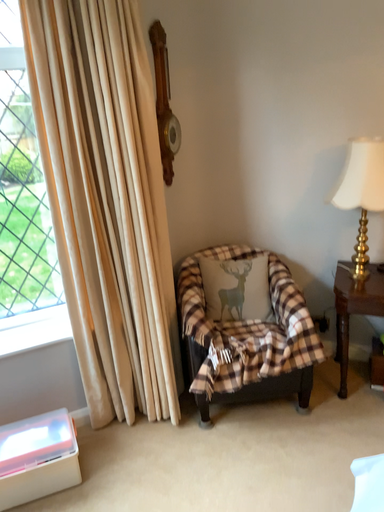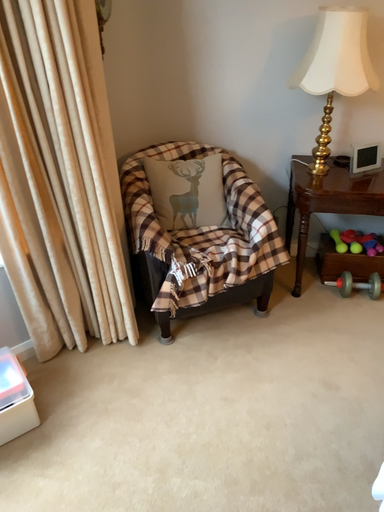
Question: Which way did the camera rotate in the video?

Choices:
 (A) rotated upward
 (B) rotated downward

Answer: (B)